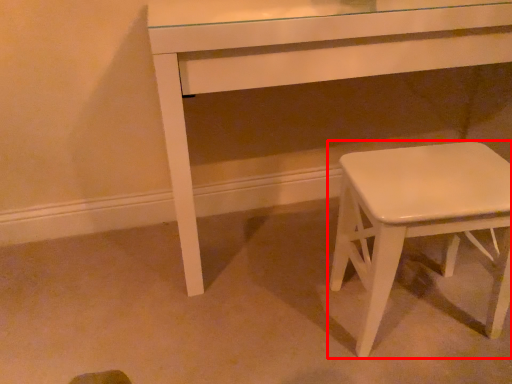
Question: Considering the relative positions of stool (annotated by the red box) and table in the image provided, where is stool (annotated by the red box) located with respect to the staircase?

Choices:
 (A) right
 (B) left

Answer: (A)